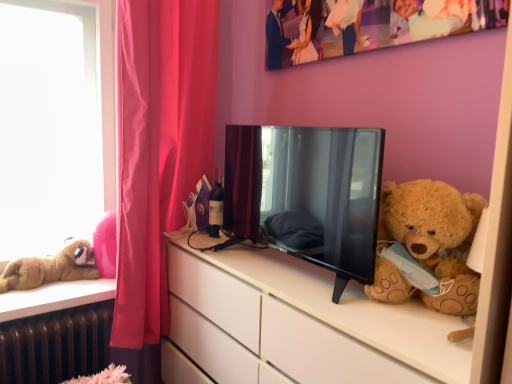
At what (x,y) coordinates should I click in order to perform the action: click on free space below black glossy tv at center (from a real-world perspective). Please return your answer as a coordinate pair (x, y). Looking at the image, I should click on (285, 276).